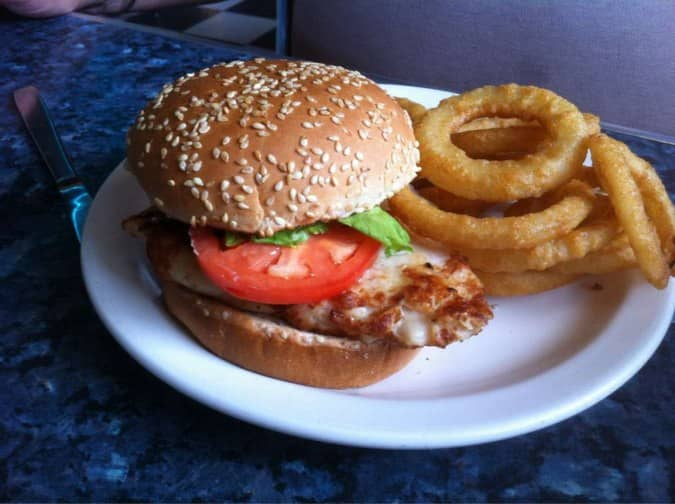
Locate an element on the screen. The height and width of the screenshot is (504, 675). wall is located at coordinates (513, 19).